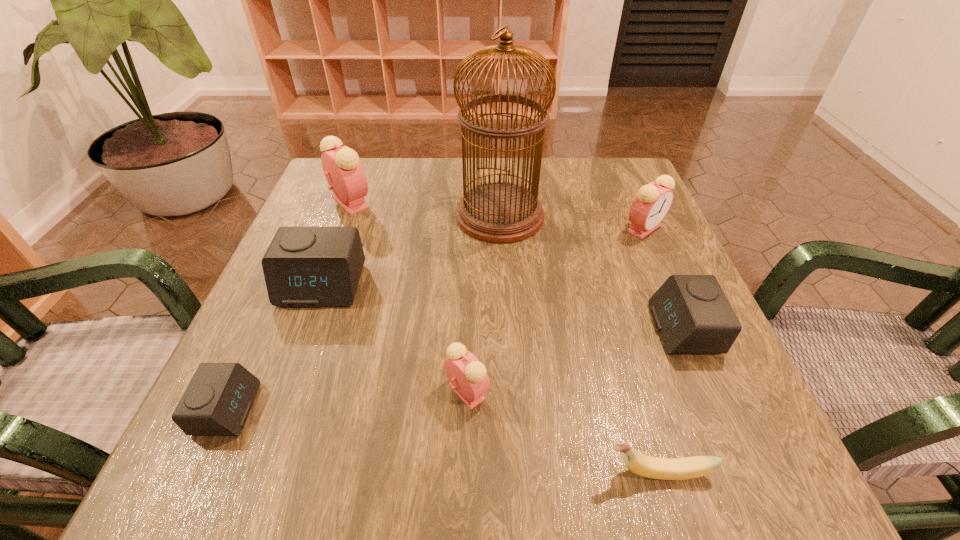
Where is `alarm clock located in the near edge section of the desktop`? The image size is (960, 540). alarm clock located in the near edge section of the desktop is located at coordinates click(217, 401).

This screenshot has width=960, height=540. I want to click on banana located at the right edge, so click(646, 466).

You are a GUI agent. You are given a task and a screenshot of the screen. Output one action in this format:
    pyautogui.click(x=<x>, y=<y>)
    Task: Click on the object that is positioned at the far left corner
    
    Given the screenshot: What is the action you would take?
    pyautogui.click(x=344, y=173)

Image resolution: width=960 pixels, height=540 pixels. I want to click on object that is at the near left corner, so (217, 401).

Where is `object situated at the near right corner`? object situated at the near right corner is located at coordinates (646, 466).

At what (x,y) coordinates should I click in order to perform the action: click on free space at the far edge of the desktop. Please return your answer as a coordinate pair (x, y). The height and width of the screenshot is (540, 960). Looking at the image, I should click on (457, 201).

In the image, there is a desktop. Identify the location of vacant space at the near edge. (648, 435).

I want to click on free space at the left edge of the desktop, so click(285, 386).

I want to click on blank space at the right edge of the desktop, so click(x=589, y=211).

In the image, there is a desktop. At what (x,y) coordinates should I click in order to perform the action: click on vacant space at the far left corner. Please return your answer as a coordinate pair (x, y). The image size is (960, 540). Looking at the image, I should click on 311,207.